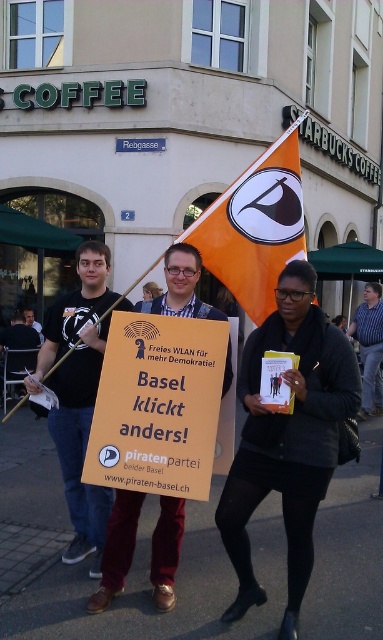
Question: Is orange fabric flag at center below blue plaid shirt at center?

Choices:
 (A) yes
 (B) no

Answer: (B)

Question: Can you confirm if black matte jacket at center is positioned to the right of orange fabric flag at center?

Choices:
 (A) no
 (B) yes

Answer: (B)

Question: Which of the following is the closest to the observer?

Choices:
 (A) (80, 497)
 (B) (130, 442)
 (C) (340, 364)

Answer: (B)

Question: Which object appears closest to the camera in this image?

Choices:
 (A) blue plaid shirt at center
 (B) orange fabric flag at center
 (C) yellow paper sign at center
 (D) black fabric sign at center

Answer: (C)

Question: Which point is closer to the camera?

Choices:
 (A) blue plaid shirt at center
 (B) black matte jacket at center
 (C) black fabric sign at center

Answer: (B)

Question: Can you confirm if yellow paper sign at center is bigger than black fabric sign at center?

Choices:
 (A) no
 (B) yes

Answer: (A)